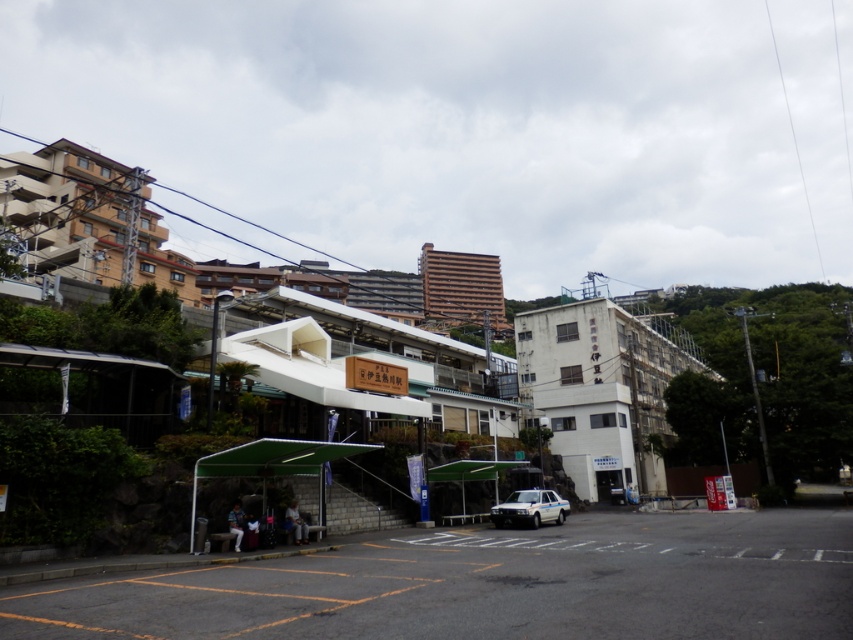
Question: Which object is farther from the camera taking this photo?

Choices:
 (A) blue denim jeans at lower left
 (B) white glossy sedan at center

Answer: (B)

Question: Is white glossy sedan at center above blue denim jeans at lower left?

Choices:
 (A) yes
 (B) no

Answer: (B)

Question: Can you confirm if dark blue fabric jacket at lower center is positioned to the right of blue denim jeans at lower left?

Choices:
 (A) yes
 (B) no

Answer: (A)

Question: Is white glossy sedan at center positioned at the back of blue denim jeans at lower left?

Choices:
 (A) yes
 (B) no

Answer: (A)

Question: Among these points, which one is nearest to the camera?

Choices:
 (A) (294, 534)
 (B) (520, 508)
 (C) (236, 506)

Answer: (C)

Question: Which point is farther from the camera taking this photo?

Choices:
 (A) (233, 504)
 (B) (514, 493)

Answer: (B)